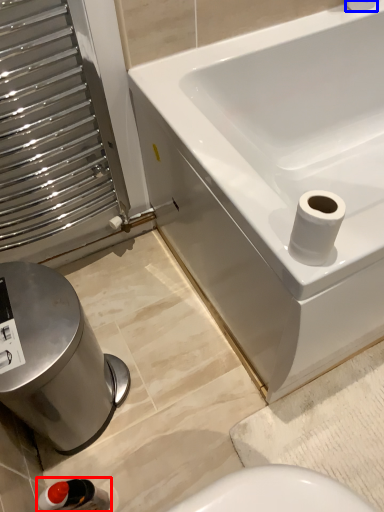
Question: Which of the following is the farthest to the observer, plumbing fixture (highlighted by a red box) or toilet paper (highlighted by a blue box)?

Choices:
 (A) plumbing fixture
 (B) toilet paper

Answer: (B)